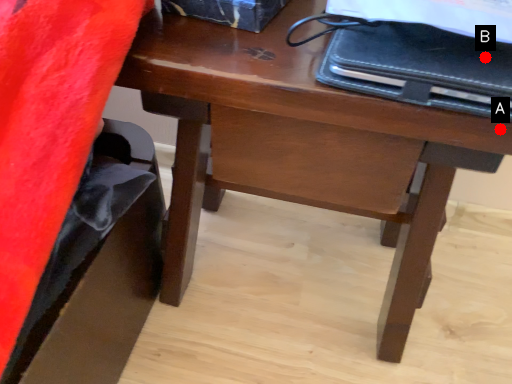
Question: Two points are circled on the image, labeled by A and B beside each circle. Which point is further to the camera?

Choices:
 (A) A is further
 (B) B is further

Answer: (B)